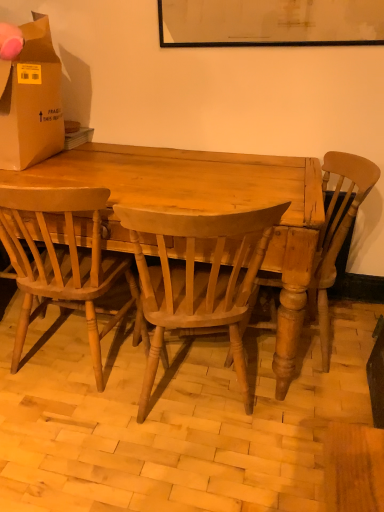
Question: Considering the relative positions of light brown wood chair at center, acting as the 1th chair starting from the right, and light brown wood chair at center, the second chair positioned from the left, in the image provided, is light brown wood chair at center, acting as the 1th chair starting from the right, to the left of light brown wood chair at center, the second chair positioned from the left, from the viewer's perspective?

Choices:
 (A) no
 (B) yes

Answer: (A)

Question: Considering the relative sizes of light brown wood chair at center, which ranks as the 3th chair in left-to-right order, and light brown wood chair at center, which is the second chair from right to left, in the image provided, is light brown wood chair at center, which ranks as the 3th chair in left-to-right order, bigger than light brown wood chair at center, which is the second chair from right to left,?

Choices:
 (A) yes
 (B) no

Answer: (A)

Question: From a real-world perspective, is light brown wood chair at center, acting as the 1th chair starting from the right, located higher than light brown wood chair at center, the second chair positioned from the left?

Choices:
 (A) no
 (B) yes

Answer: (B)

Question: Can you confirm if light brown wood chair at center, which ranks as the 3th chair in left-to-right order, is wider than light brown wood chair at center, which is the second chair from right to left?

Choices:
 (A) no
 (B) yes

Answer: (A)

Question: From a real-world perspective, is light brown wood chair at center, acting as the 1th chair starting from the right, positioned under light brown wood chair at center, which is the second chair from right to left, based on gravity?

Choices:
 (A) no
 (B) yes

Answer: (A)

Question: Is light brown wood chair at center, acting as the 1th chair starting from the right, further to camera compared to light brown wood chair at center, the second chair positioned from the left?

Choices:
 (A) no
 (B) yes

Answer: (B)

Question: From the image's perspective, does light brown wood chair at center, acting as the 1th chair starting from the right, appear higher than light brown wood chair at center, which is the first chair in left-to-right order?

Choices:
 (A) no
 (B) yes

Answer: (B)

Question: Can you confirm if light brown wood chair at center, acting as the 1th chair starting from the right, is shorter than light brown wood chair at center, placed as the third chair when sorted from right to left?

Choices:
 (A) yes
 (B) no

Answer: (B)

Question: Is light brown wood chair at center, which ranks as the 3th chair in left-to-right order, in contact with light brown wood chair at center, placed as the third chair when sorted from right to left?

Choices:
 (A) yes
 (B) no

Answer: (B)

Question: Does light brown wood chair at center, acting as the 1th chair starting from the right, come behind light brown wood chair at center, placed as the third chair when sorted from right to left?

Choices:
 (A) yes
 (B) no

Answer: (A)

Question: Considering the relative sizes of light brown wood chair at center, which ranks as the 3th chair in left-to-right order, and light brown wood chair at center, placed as the third chair when sorted from right to left, in the image provided, is light brown wood chair at center, which ranks as the 3th chair in left-to-right order, bigger than light brown wood chair at center, placed as the third chair when sorted from right to left,?

Choices:
 (A) no
 (B) yes

Answer: (B)

Question: From the image's perspective, is light brown wood chair at center, which ranks as the 3th chair in left-to-right order, under light brown wood chair at center, placed as the third chair when sorted from right to left?

Choices:
 (A) yes
 (B) no

Answer: (B)

Question: Can brown cardboard box at upper left be found inside light brown wood chair at center, acting as the 1th chair starting from the right?

Choices:
 (A) no
 (B) yes

Answer: (A)